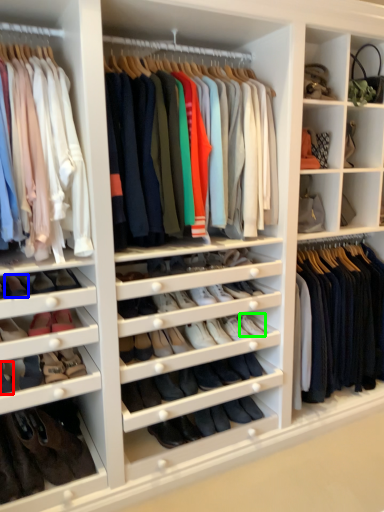
Question: Considering the real-world distances, which object is closest to shoe (highlighted by a red box)? shoe (highlighted by a blue box) or shoe (highlighted by a green box).

Choices:
 (A) shoe
 (B) shoe

Answer: (A)